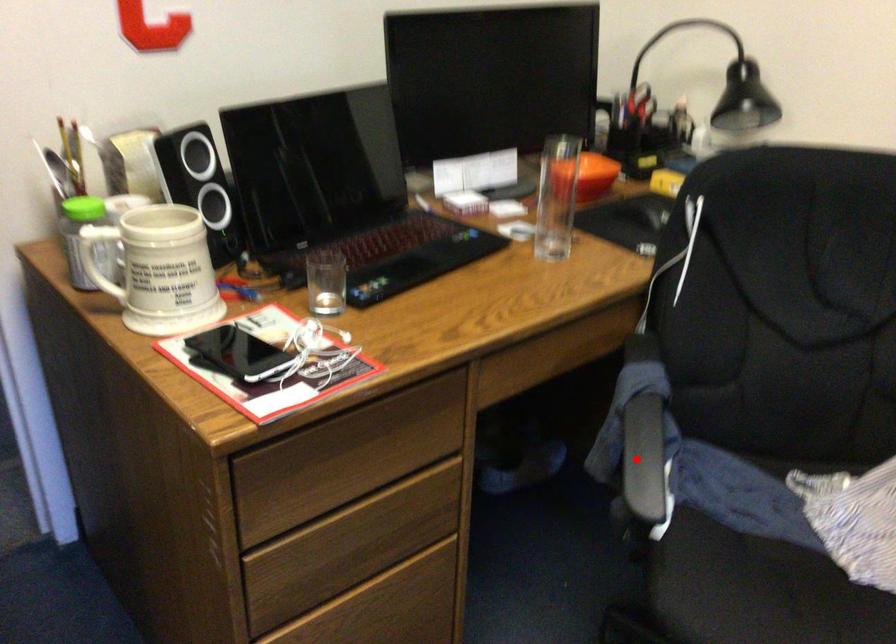
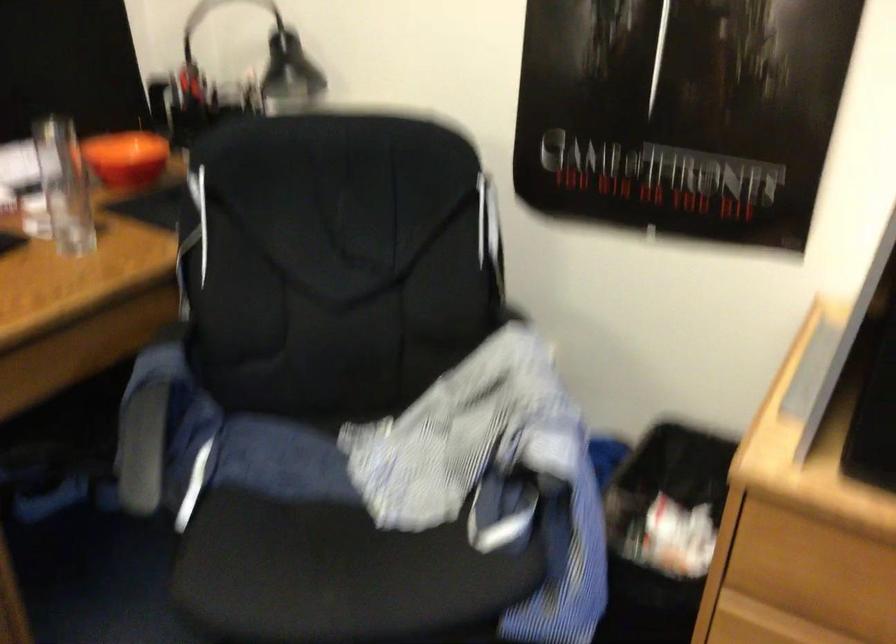
Find the pixel in the second image that matches the highlighted location in the first image.

(142, 448)